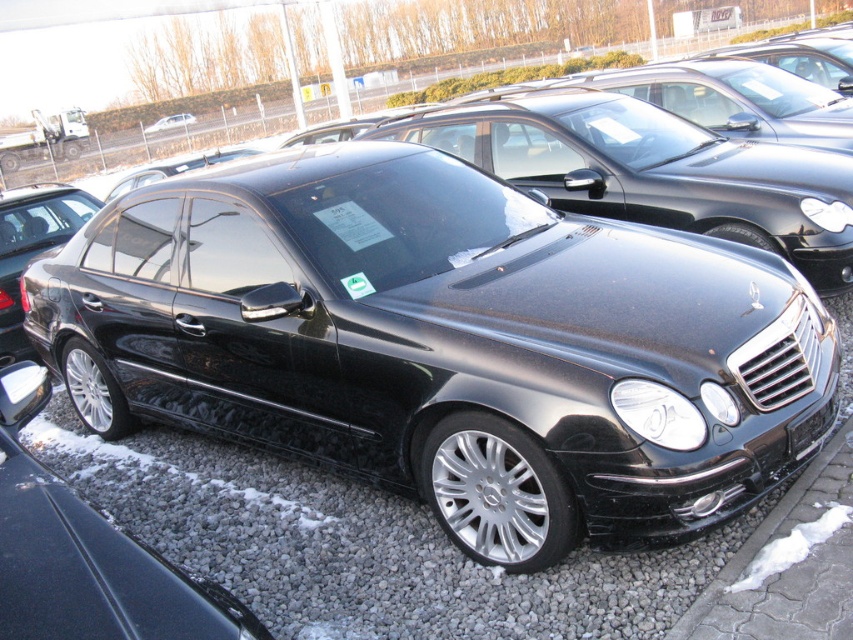
Is point (358, 387) closer to camera compared to point (161, 120)?

Yes, point (358, 387) is in front of point (161, 120).

Is point (202, 381) positioned after point (177, 116)?

No.

Identify the location of glossy black sedan at center. click(445, 342).

You are a GUI agent. You are given a task and a screenshot of the screen. Output one action in this format:
    pyautogui.click(x=<x>, y=<y>)
    Task: Click on the gray gravel at lower center
    The image size is (853, 640).
    Given the screenshot: What is the action you would take?
    pyautogui.click(x=358, y=545)

Does glossy black sedan at center have a lesser width compared to gray gravel at lower center?

Incorrect, glossy black sedan at center's width is not less than gray gravel at lower center's.

Who is more distant from viewer, (438,464) or (161,524)?

Positioned behind is point (161,524).

Measure the distance between glossy black sedan at center and camera.

glossy black sedan at center is 2.61 meters from camera.

The width and height of the screenshot is (853, 640). Find the location of `glossy black sedan at center`. glossy black sedan at center is located at coordinates tap(445, 342).